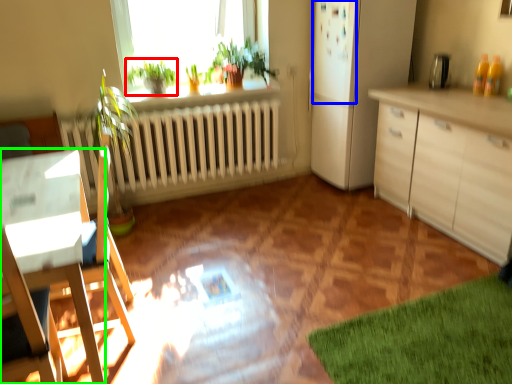
Question: Estimate the real-world distances between objects in this image. Which object is closer to plant (highlighted by a red box), screen door (highlighted by a blue box) or desk (highlighted by a green box)?

Choices:
 (A) screen door
 (B) desk

Answer: (A)